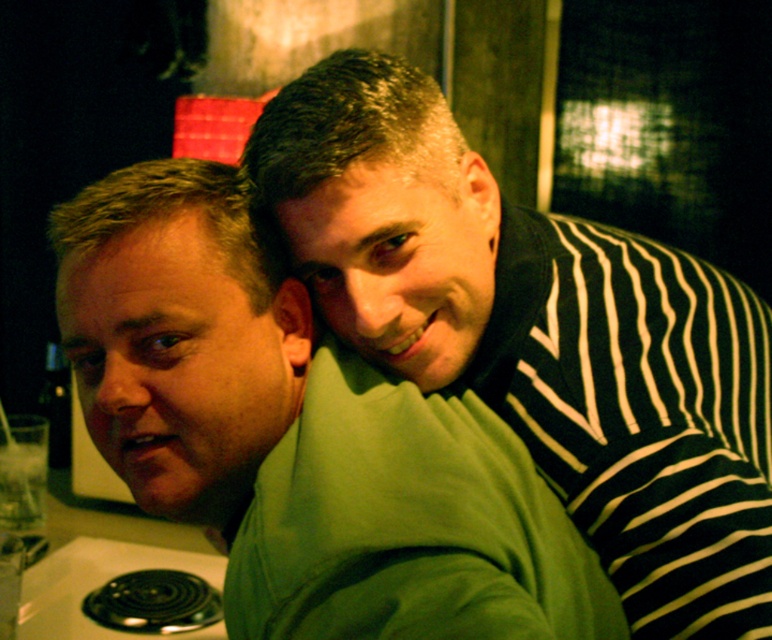
You are a photographer trying to capture the perfect shot of the scene. You want to focus on the green fabric at upper left. Based on its position, where should you aim your camera?

The green fabric at upper left is located at coordinates point (539, 333). Aim your camera at that point to capture it.

You are a photographer trying to capture a candid shot of the two people in the scene. You notice the green fabric at upper left and the green matte sweatshirt at center. Which object is positioned to the right of the other?

The green fabric at upper left is positioned to the right of the green matte sweatshirt at center.